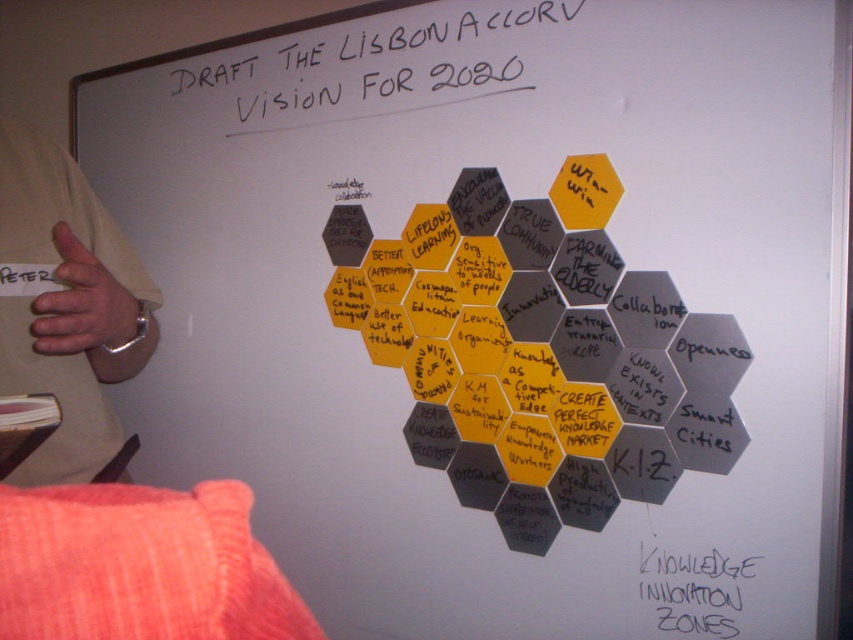
Question: Which of these objects is positioned farthest from the white marker text at upper center?

Choices:
 (A) black paper at center
 (B) beige fabric at left

Answer: (A)

Question: Does white marker text at upper center appear on the right side of black paper at center?

Choices:
 (A) yes
 (B) no

Answer: (B)

Question: Can you confirm if white marker text at upper center is thinner than black paper at center?

Choices:
 (A) yes
 (B) no

Answer: (B)

Question: Among these points, which one is nearest to the camera?

Choices:
 (A) (663, 556)
 (B) (492, 22)
 (C) (86, 314)

Answer: (C)

Question: Does white marker text at upper center come behind black paper at center?

Choices:
 (A) yes
 (B) no

Answer: (A)

Question: Which object is farther from the camera taking this photo?

Choices:
 (A) beige fabric at left
 (B) white marker text at upper center

Answer: (B)